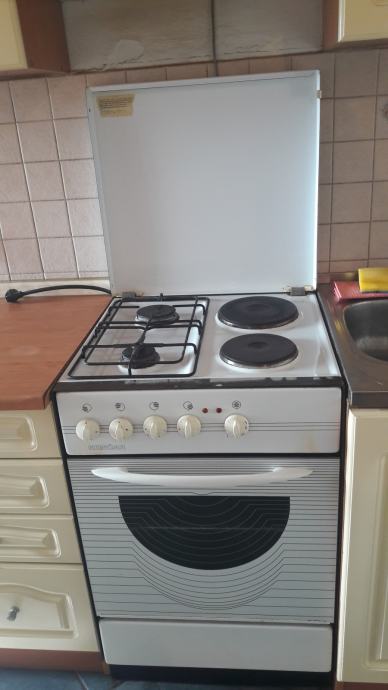
At what (x,y) coordinates should I click in order to perform the action: click on white oven handle. Please return your answer as a coordinate pair (x, y). Looking at the image, I should click on (274, 473).